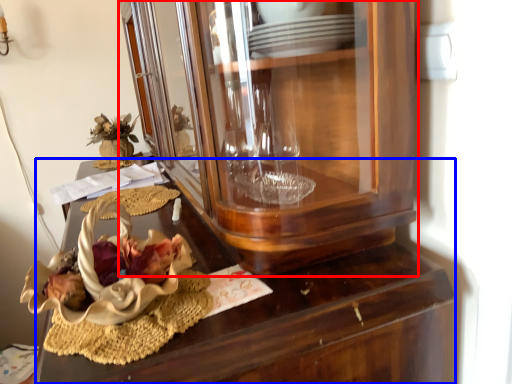
Question: Which object appears closest to the camera in this image, cabinetry (highlighted by a red box) or desk (highlighted by a blue box)?

Choices:
 (A) cabinetry
 (B) desk

Answer: (A)